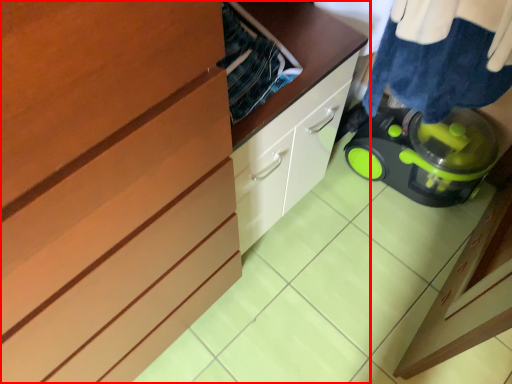
Question: From the image's perspective, what is the correct spatial positioning of cabinetry (annotated by the red box) in reference to laundry?

Choices:
 (A) above
 (B) below

Answer: (B)